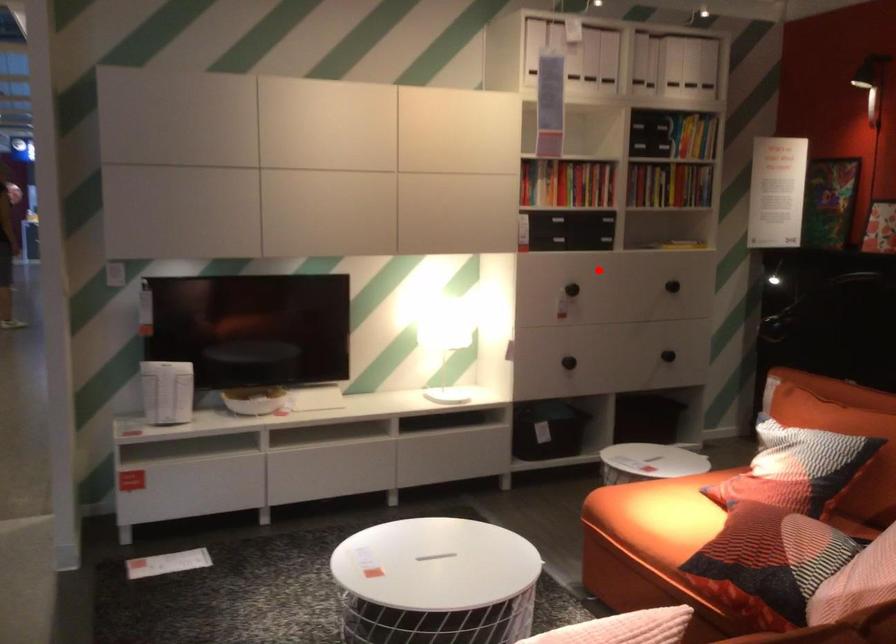
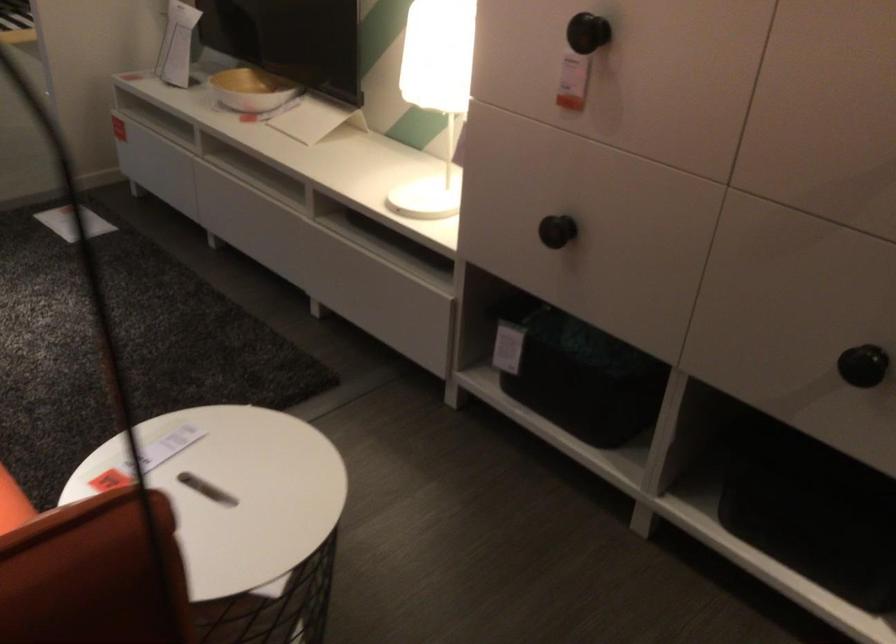
Where in the second image is the point corresponding to the highlighted location from the first image?

(588, 33)